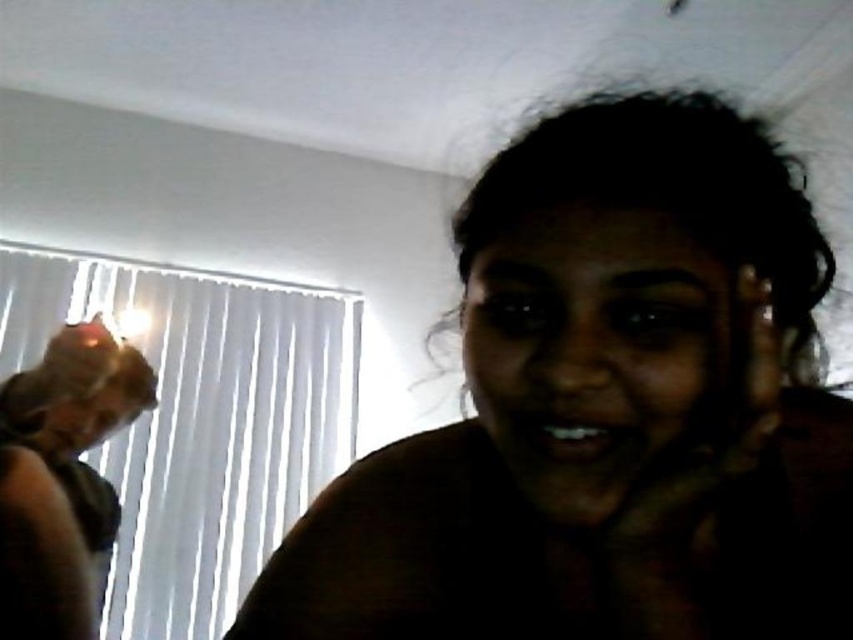
Question: Which point is closer to the camera taking this photo?

Choices:
 (A) (479, 353)
 (B) (68, 291)
 (C) (62, 449)

Answer: (A)

Question: Which point appears farthest from the camera in this image?

Choices:
 (A) (489, 349)
 (B) (315, 477)

Answer: (B)

Question: Does white vertical blinds at left have a greater width compared to matte plastic face at left?

Choices:
 (A) yes
 (B) no

Answer: (A)

Question: Which of the following is the closest to the observer?

Choices:
 (A) (3, 291)
 (B) (38, 438)
 (C) (80, 593)

Answer: (C)

Question: Can you confirm if dark skin woman at center is smaller than matte plastic face at left?

Choices:
 (A) no
 (B) yes

Answer: (A)

Question: Can you confirm if dark skin woman at center is positioned to the right of matte plastic face at left?

Choices:
 (A) no
 (B) yes

Answer: (B)